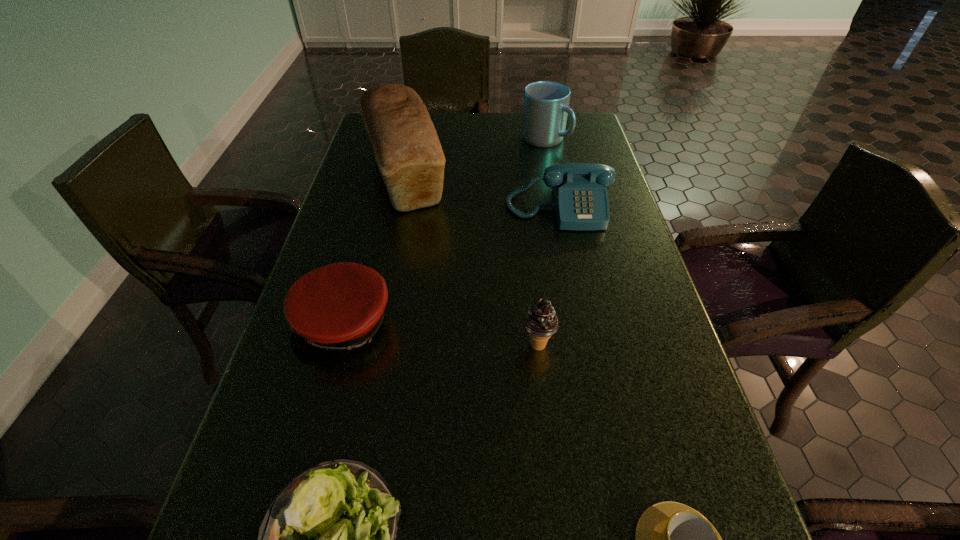
Where is `vacant space at the right edge`? This screenshot has height=540, width=960. vacant space at the right edge is located at coordinates (663, 419).

This screenshot has width=960, height=540. In order to click on vacant space at the far right corner in this screenshot , I will do `click(577, 129)`.

This screenshot has width=960, height=540. In order to click on empty space between the mug and the cap in this screenshot , I will do `click(444, 232)`.

Find the location of a particular element. The image size is (960, 540). free space between the tallest object and the cap is located at coordinates (375, 251).

Find the location of a particular element. vacant space that's between the mug and the cap is located at coordinates (444, 232).

In order to click on vacant space that's between the telephone and the cap in this screenshot , I will do `click(452, 267)`.

Where is `object that is the closest to the mug`? object that is the closest to the mug is located at coordinates (580, 195).

Locate which object is the closest to the tallest object. Please provide its 2D coordinates. Your answer should be formatted as a tuple, i.e. [(x, y)], where the tuple contains the x and y coordinates of a point satisfying the conditions above.

[(580, 195)]